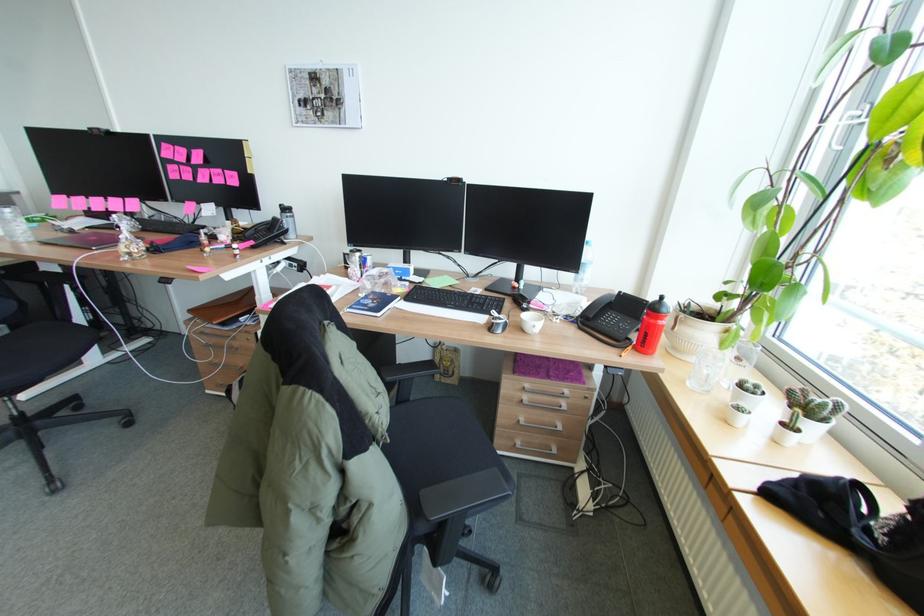
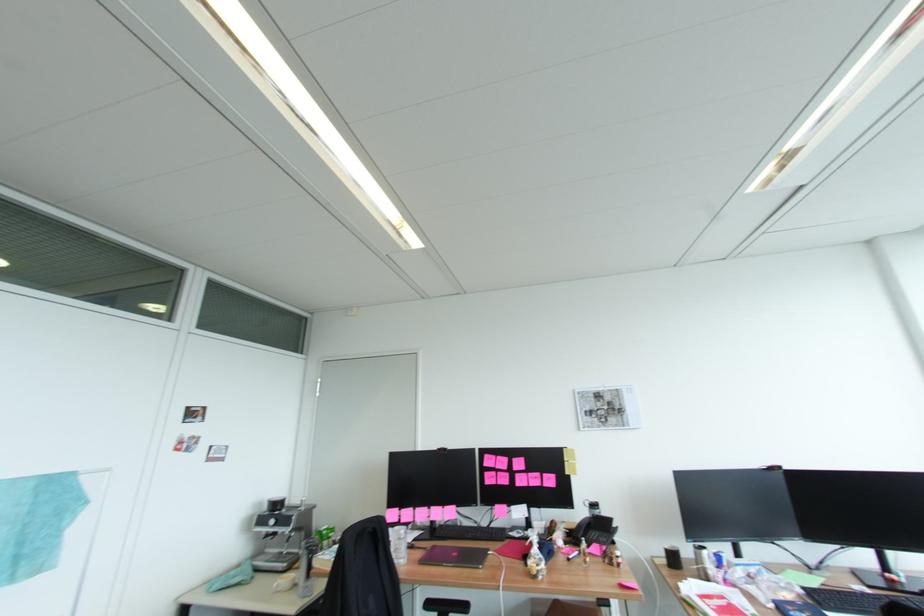
Where in the second image is the point corresponding to point 203,156 from the first image?

(524, 463)